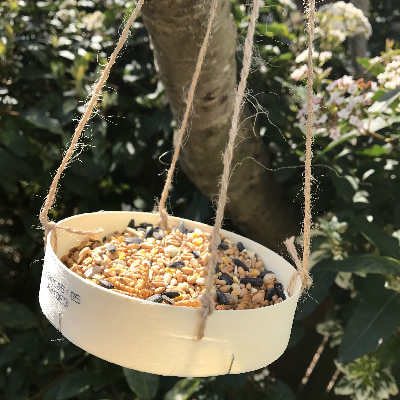
This screenshot has width=400, height=400. In order to click on circular cardboard container in this screenshot , I will do `click(252, 334)`.